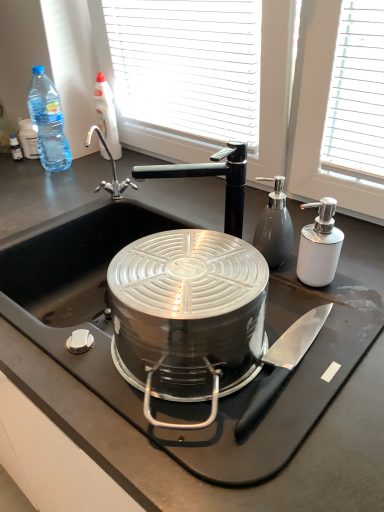
I want to click on free spot to the left of polished stainless steel knife at lower center, so click(163, 392).